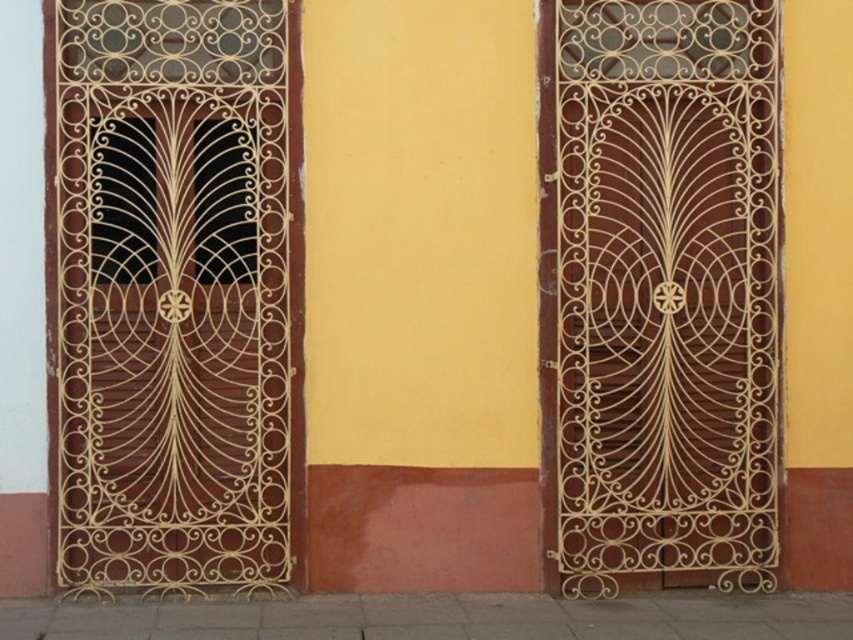
You are a delivery person carrying a large package that is 2 meters wide. You need to pass through either the gold wrought iron door at left or the brown wood door at center. Can you fit through either of them? Explain your reasoning.

The gold wrought iron door at left and brown wood door at center are 1.98 meters apart from each other. Since the package is 2 meters wide, which is slightly wider than the distance between the doors, you cannot fit through either door without adjusting the package or moving it sideways.

You are standing in front of two doors, the gold wrought iron door at left and the brown wood door at center. Which door is nearer to you?

The gold wrought iron door at left is closer to the viewer than the brown wood door at center, so the gold wrought iron door at left is nearer to you.